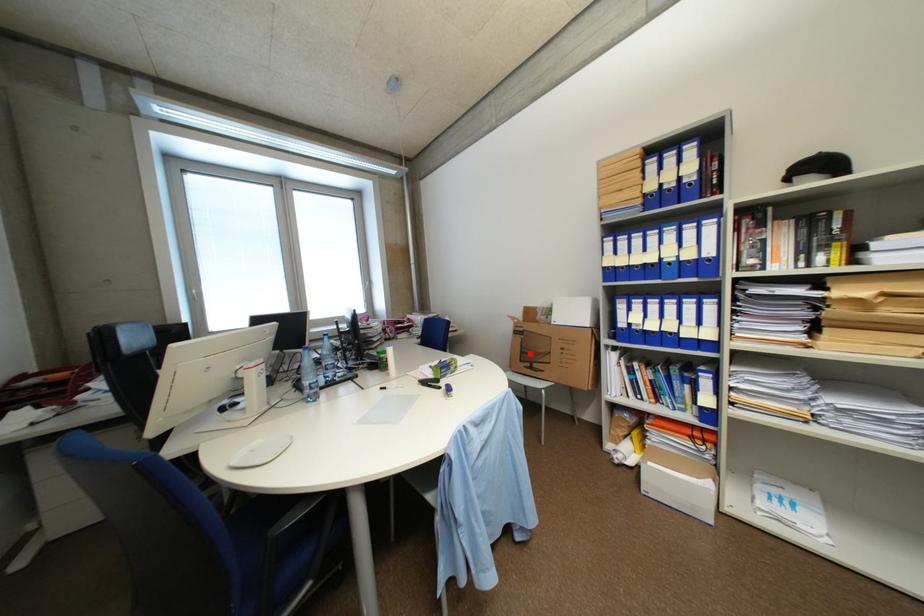
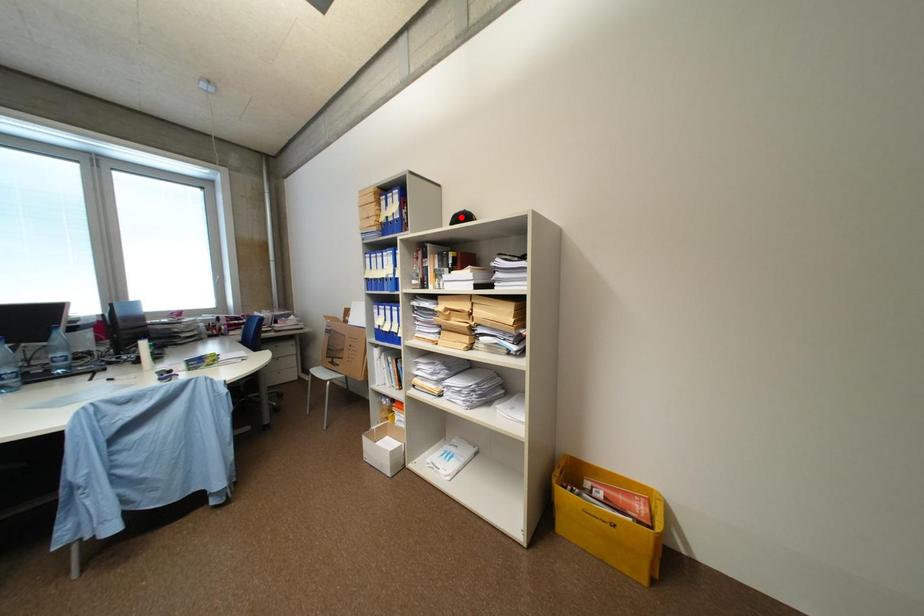
I am providing you with two images of the same scene from different viewpoints. A red point is marked on the first image and another point is marked on the second image. Are the points marked in image1 and image2 representing the same 3D position?

No